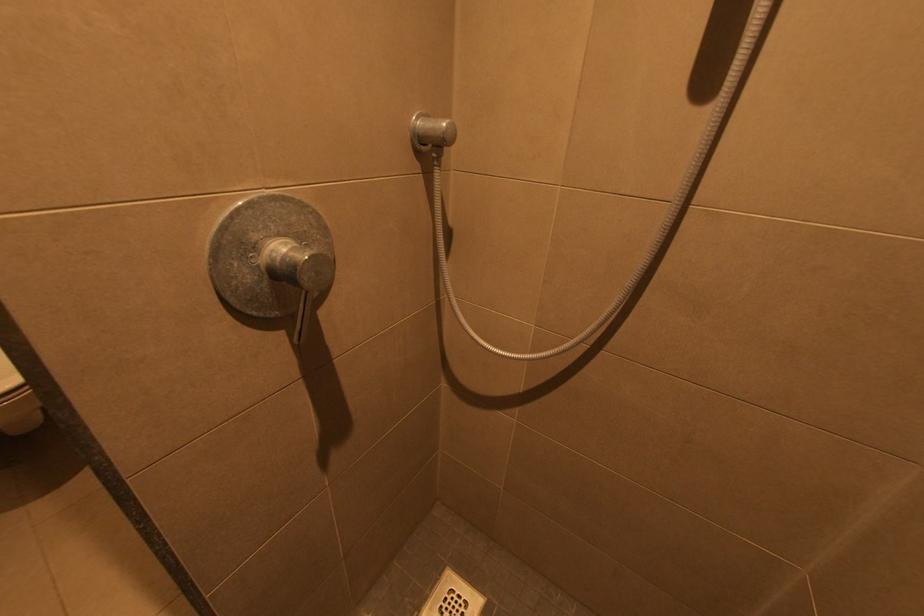
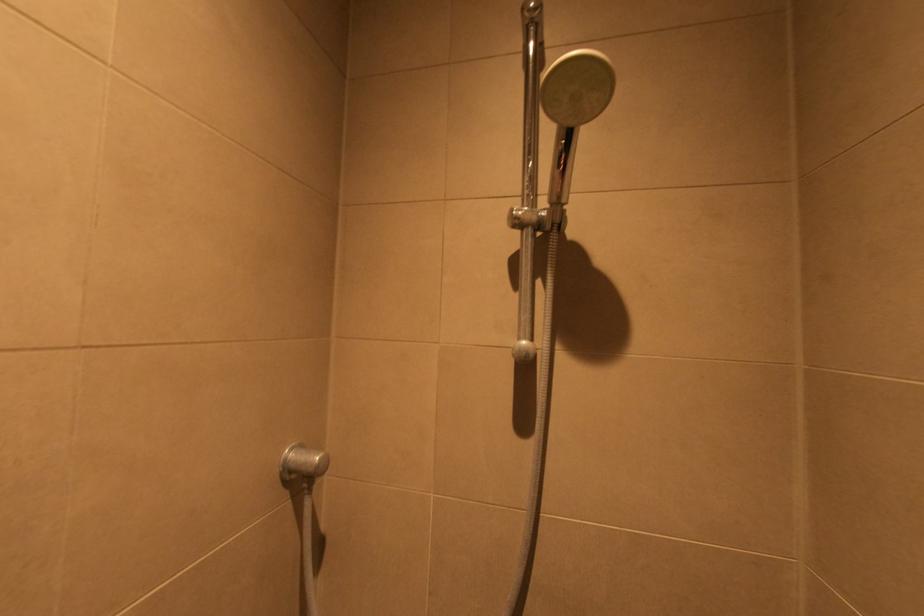
The images are taken continuously from a first-person perspective. In which direction is your viewpoint rotating?

The camera's rotation is toward right-up.